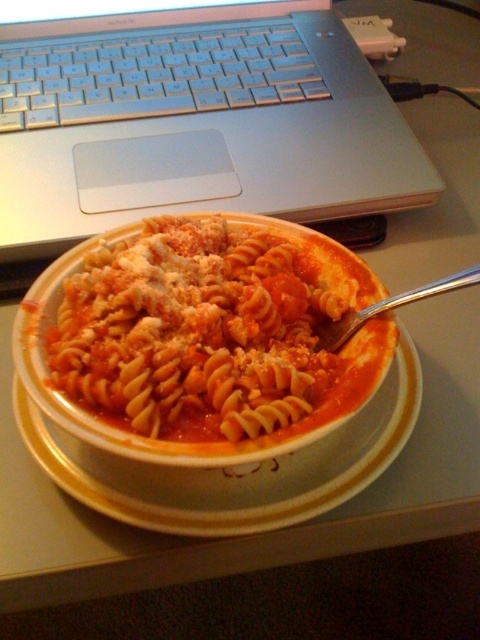
You are a delivery robot that needs to place a small package on the table where the white ceramic bowl at center is located. The package is 12 inches long. Can you safely place it on the table without moving the bowl?

The white ceramic bowl at center and camera are 14.29 inches apart from each other. Since the package is 12 inches long, which is shorter than the distance between the bowl and the camera, you can safely place the package on the table without moving the bowl.

You are setting up a workspace and want to place both the silver metallic laptop at upper left and the matte tomato sauce pasta at center on the desk. Given their current arrangement, which object should you move to the right to make more space for a mouse?

The silver metallic laptop at upper left is on the left side of the matte tomato sauce pasta at center. To make more space for the mouse, you should move the silver metallic laptop at upper left further to the right so that it is positioned to the right of the matte tomato sauce pasta at center.

You are setting up a workspace and want to place both the silver metallic laptop at upper left and the matte tomato sauce pasta at center on a desk. Given their sizes, which object should you place first to ensure there is enough space for both?

The silver metallic laptop at upper left has a larger size compared to matte tomato sauce pasta at center, so you should place the silver metallic laptop at upper left first to ensure there is enough space for both.